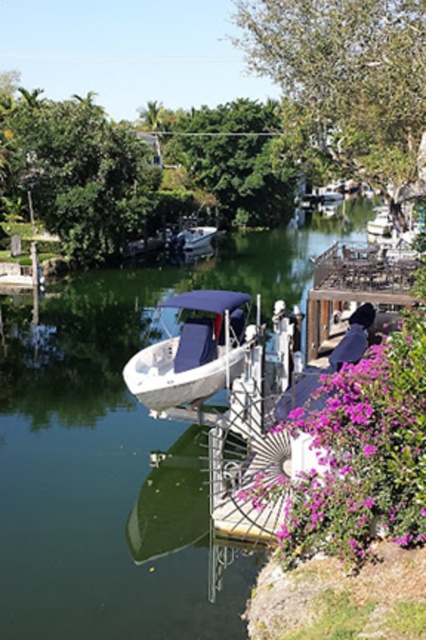
You are a photographer trying to capture the white matte boat at center and the purple matte flower at lower right in the same frame. Based on their positions, will the flower appear smaller or larger in the photo compared to the boat?

The purple matte flower at lower right is below the white matte boat at center. Since the flower is positioned lower in the frame, it might appear smaller due to perspective, but without knowing their actual sizes or distances, we can only confirm their spatial relationship.

You are planning to place a small decorative statue on the purple matte flower at lower right. Considering the size of the flower, will it be able to support the statue without the statue falling into the green smooth water at center?

The green smooth water at center is bigger than the purple matte flower at lower right, so the purple matte flower at lower right might not have enough space to securely hold the statue, increasing the risk of it falling into the green smooth water at center.

You are standing at the point marked by the coordinates point (120, 452) in the image. Based on the scene described, what would you most likely be standing on?

The point (120, 452) indicates green smooth water at center, so you would be standing on the green smooth water at center.